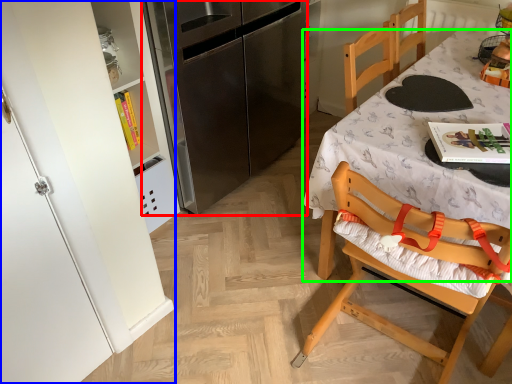
Question: Which object is positioned closest to refrigerator (highlighted by a red box)? Select from cabinetry (highlighted by a blue box) and desk (highlighted by a green box).

Choices:
 (A) cabinetry
 (B) desk

Answer: (B)